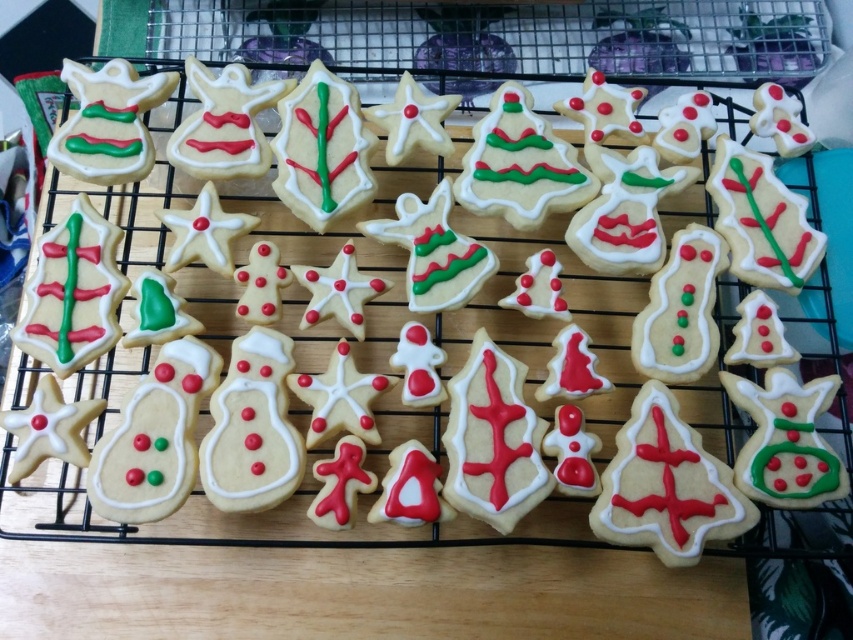
Question: Based on their relative distances, which object is farther from the white glossy christmas tree at center?

Choices:
 (A) matte white gingerbread at center-right
 (B) matte white gingerbread at center

Answer: (A)

Question: Which point is farther to the camera?

Choices:
 (A) matte white gingerbread at center-right
 (B) matte white gingerbread at center
 (C) matte white gingerbread at upper left

Answer: (A)

Question: Is white glossy christmas tree at center thinner than matte white gingerbread at upper left?

Choices:
 (A) yes
 (B) no

Answer: (B)

Question: Is matte white gingerbread at center-right bigger than matte white gingerbread at upper left?

Choices:
 (A) no
 (B) yes

Answer: (B)

Question: Which object appears farthest from the camera in this image?

Choices:
 (A) matte white gingerbread at center-right
 (B) matte white gingerbread at upper left
 (C) matte white gingerbread at center
 (D) white glossy christmas tree at center

Answer: (A)

Question: From the image, what is the correct spatial relationship of matte white gingerbread at center in relation to matte white gingerbread at upper left?

Choices:
 (A) right
 (B) left

Answer: (A)